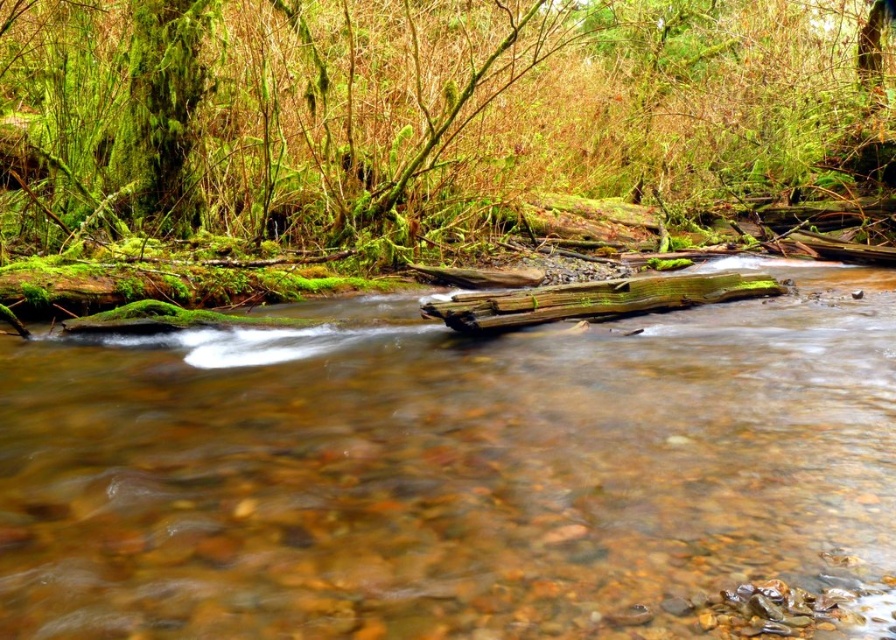
You are standing at the edge of the forest stream and want to cross to the other side. You see the clear water at center and the green mossy log at upper center. Which object is closer to you, making it easier to step onto first?

The clear water at center is closer to the viewer than the green mossy log at upper center, so you can step onto the clear water at center first.

You are a hiker carrying a 100 feet rope. You need to cross the stream using the green mossy log at upper center as an anchor point. Can you safely secure the rope to the log and reach the clear water at center?

The clear water at center and green mossy log at upper center are 64.78 feet apart. Since the rope is 100 feet long, it is long enough to secure the rope to the log and reach the clear water at center safely.

You are standing at the edge of the forest stream and see two points marked in the image. Which point, point (687, 394) or point (700, 301), is closer to you?

Point (687, 394) is closer to the viewer than point (700, 301).